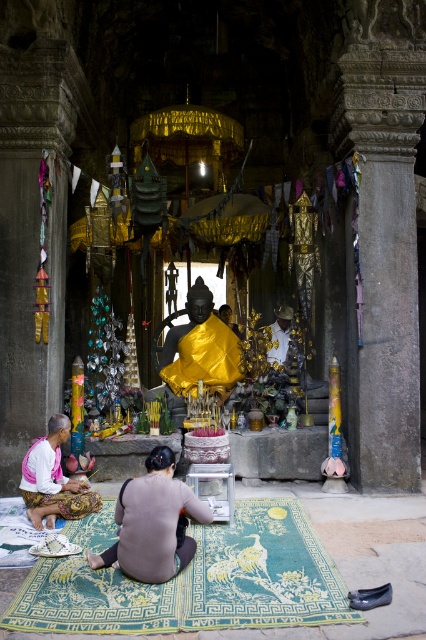
You are a visitor in this temple and want to place a new offering on the green woven mat at lower center. However, you need to walk around the shiny gold statue at center to reach it. Which direction should you move relative to the statue to get to the mat?

The green woven mat at lower center is positioned on the right side of the shiny gold statue at center. To reach the mat, you should move to the right of the statue.

You are a visitor standing at the entrance of the temple. You see the green woven mat at lower center and the shiny gold statue at center. Which object is nearer to you?

The green woven mat at lower center is closer to the viewer than the shiny gold statue at center, so the green woven mat at lower center is nearer to you.

You are an artist planning to sketch the temple scene. You notice the gray matte fabric at center and the shiny gold statue at center. Which object is wider?

The shiny gold statue at center is wider than the gray matte fabric at center.